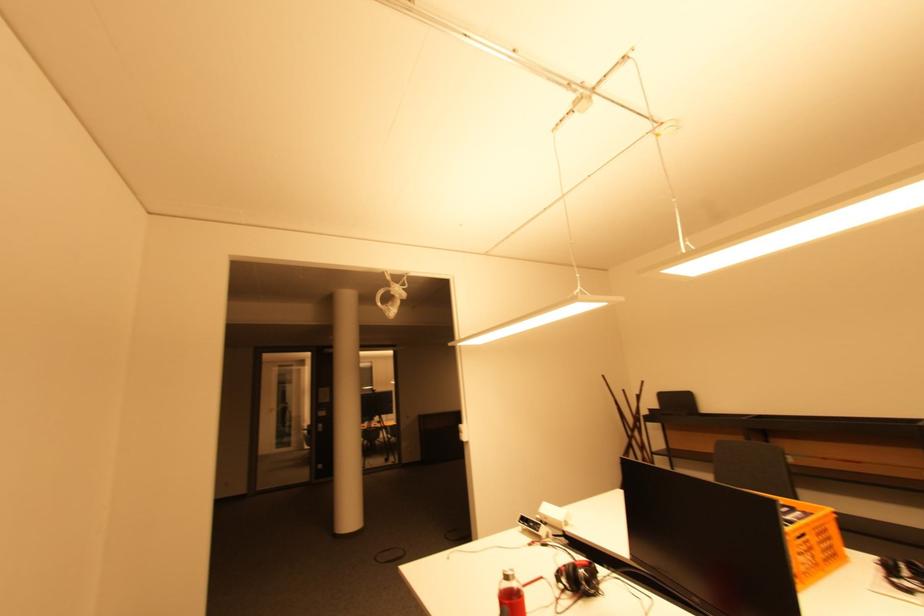
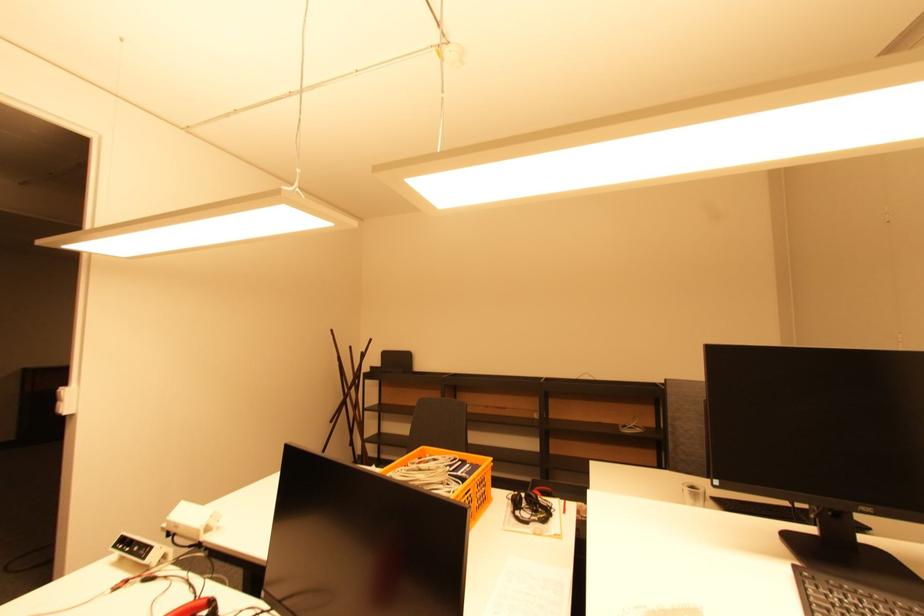
Question: Based on the continuous images, in which direction is the camera rotating? Reply with the corresponding letter.

Choices:
 (A) Left
 (B) Right
 (C) Up
 (D) Down

Answer: (B)